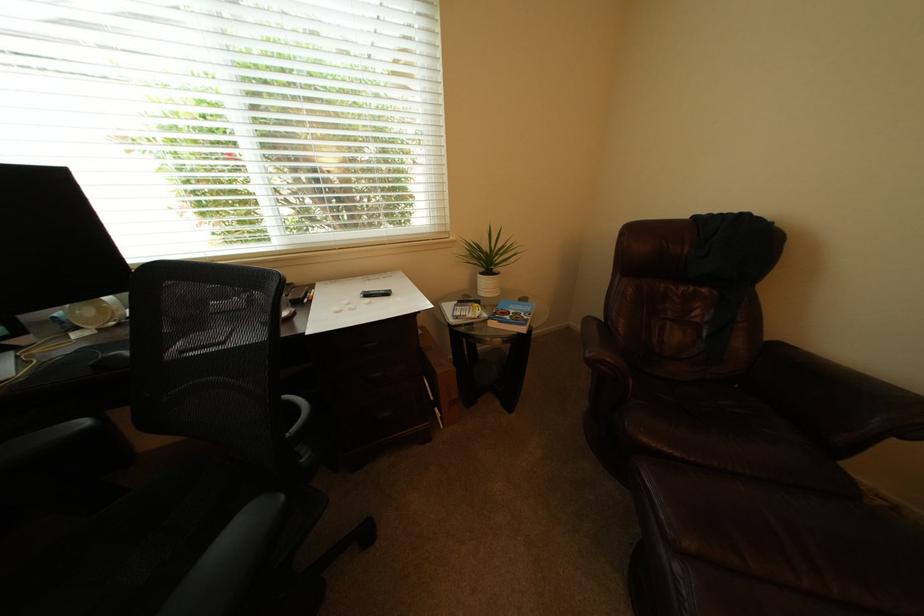
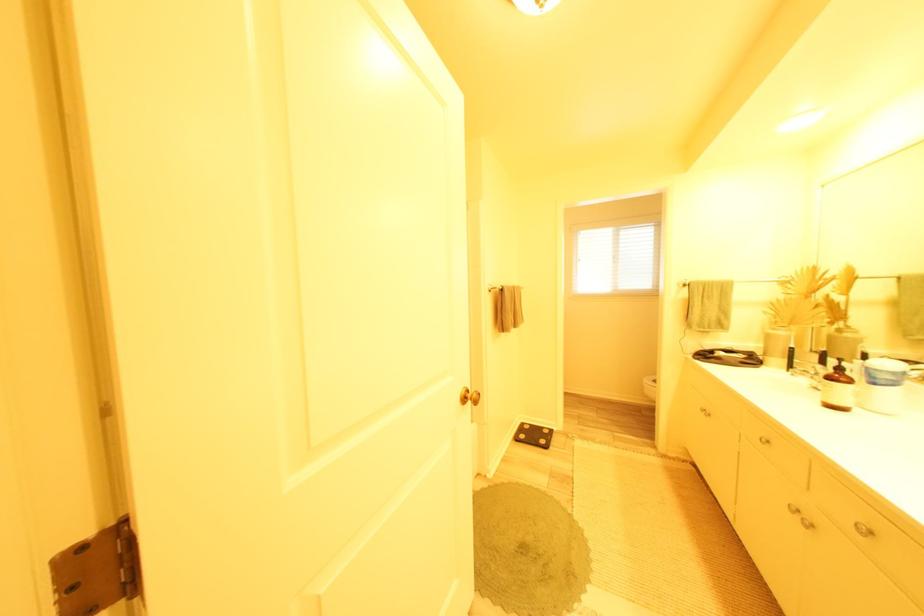
Question: I am providing you with two images of the same scene from different viewpoints. After the viewpoint changes to image2, which objects are now occluded?

Choices:
 (A) blue and white marker
 (B) black marker case
 (C) faucet handle
 (D) gold door knob

Answer: (B)